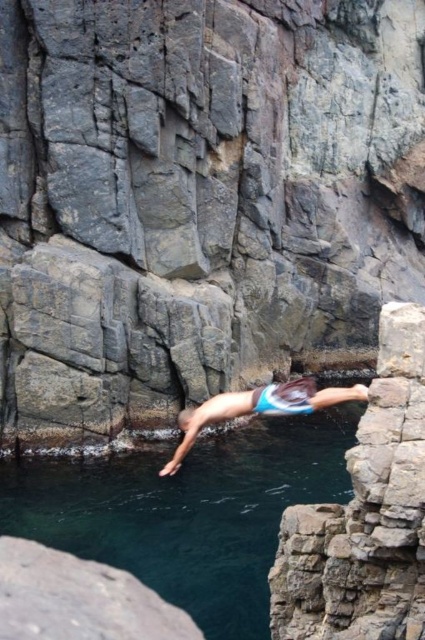
Can you confirm if clear blue water at center is positioned to the right of blue swim trunks at center?

No, clear blue water at center is not to the right of blue swim trunks at center.

Based on the photo, which is below, clear blue water at center or blue swim trunks at center?

clear blue water at center is below.

Is point (19, 525) farther from camera compared to point (186, 408)?

That is False.

Where is `clear blue water at center`? clear blue water at center is located at coordinates (187, 512).

Can you confirm if gray rock cliff at center is positioned below blue swim trunks at center?

Incorrect, gray rock cliff at center is not positioned below blue swim trunks at center.

The image size is (425, 640). What do you see at coordinates (198, 200) in the screenshot? I see `gray rock cliff at center` at bounding box center [198, 200].

Find the location of `gray rock cliff at center`. gray rock cliff at center is located at coordinates (198, 200).

Does gray rock cliff at center appear under clear blue water at center?

No.

Can you confirm if gray rock cliff at center is smaller than clear blue water at center?

Actually, gray rock cliff at center might be larger than clear blue water at center.

Where is `gray rock cliff at center`? gray rock cliff at center is located at coordinates (198, 200).

Where is `gray rock cliff at center`? gray rock cliff at center is located at coordinates (198, 200).